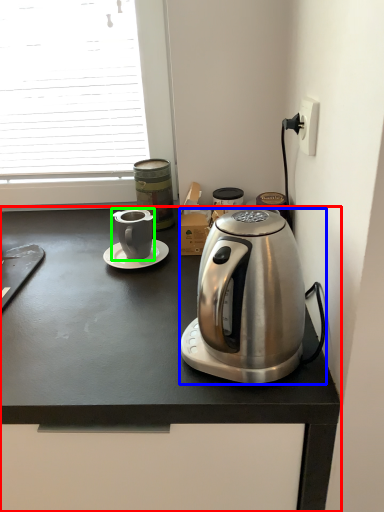
Question: Which object is positioned farthest from desk (highlighted by a red box)? Select from coffee maker (highlighted by a blue box) and coffee cup (highlighted by a green box).

Choices:
 (A) coffee maker
 (B) coffee cup

Answer: (B)